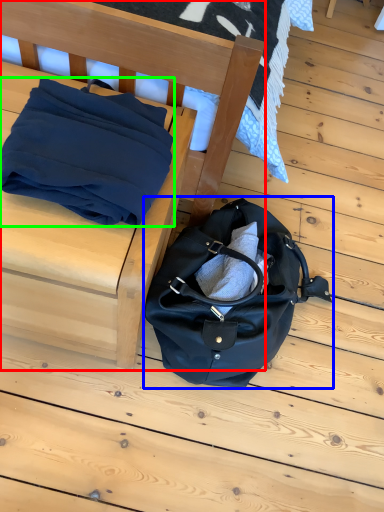
Question: Considering the real-world distances, which object is closest to furniture (highlighted by a red box)? handbag (highlighted by a blue box) or blanket (highlighted by a green box).

Choices:
 (A) handbag
 (B) blanket

Answer: (B)